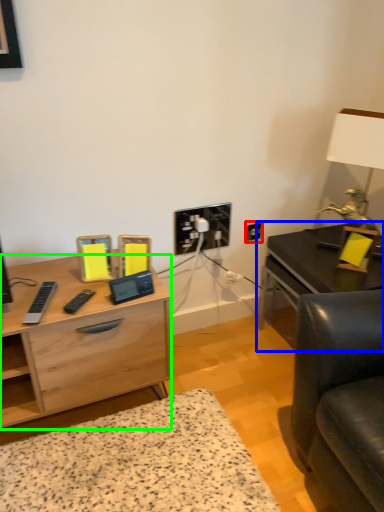
Question: Considering the real-world distances, which object is closest to electric outlet (highlighted by a red box)? table (highlighted by a blue box) or desk (highlighted by a green box).

Choices:
 (A) table
 (B) desk

Answer: (A)